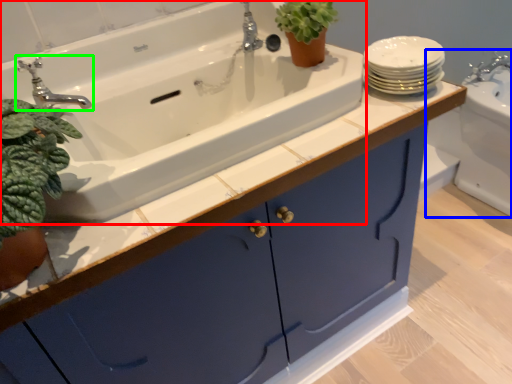
Question: Which object is positioned farthest from sink (highlighted by a red box)? Select from sink (highlighted by a blue box) and tap (highlighted by a green box).

Choices:
 (A) sink
 (B) tap

Answer: (A)